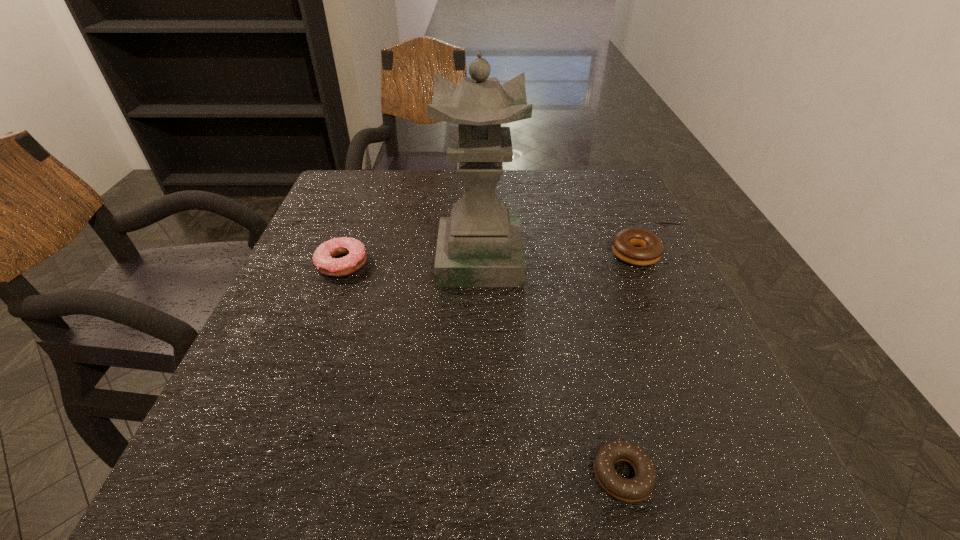
You are a GUI agent. You are given a task and a screenshot of the screen. Output one action in this format:
    pyautogui.click(x=<x>, y=<y>)
    Task: Click on the vacant space that satisfies the following two spatial constraints: 1. on the front side of the rightmost object; 2. at the front opening of the tallest object
    
    Given the screenshot: What is the action you would take?
    [x=637, y=259]

Identify the location of vacant area that satisfies the following two spatial constraints: 1. on the back side of the leftmost object; 2. on the left side of the rightmost object. (346, 254).

This screenshot has width=960, height=540. What are the coordinates of `free space that satisfies the following two spatial constraints: 1. on the back side of the shortest doughnut; 2. at the front opening of the sculpture` in the screenshot? It's located at (570, 259).

Image resolution: width=960 pixels, height=540 pixels. Find the location of `free space in the image that satisfies the following two spatial constraints: 1. at the front opening of the second object from right to left; 2. on the right side of the second object from left to right`. free space in the image that satisfies the following two spatial constraints: 1. at the front opening of the second object from right to left; 2. on the right side of the second object from left to right is located at coordinates (480, 475).

Find the location of `free space that satisfies the following two spatial constraints: 1. at the front opening of the nearest object; 2. on the left side of the tallest object`. free space that satisfies the following two spatial constraints: 1. at the front opening of the nearest object; 2. on the left side of the tallest object is located at coordinates (480, 475).